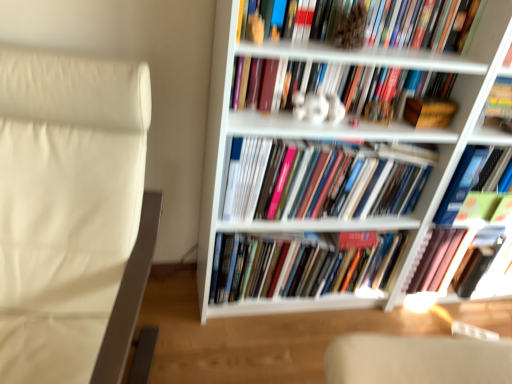
Measure the distance between multicolored paperbacks at center, acting as the 2th book starting from the bottom, and camera.

multicolored paperbacks at center, acting as the 2th book starting from the bottom, and camera are 4.78 feet apart from each other.

This screenshot has width=512, height=384. I want to click on green matte book at upper right, which is the 4th book from top to bottom, so click(464, 181).

What is the approximate width of matte hardcover books at center, which is the fourth book from bottom to top?

It is 4.99 inches.

Where is `multicolored paperbacks at center, acting as the 2th book starting from the bottom`? multicolored paperbacks at center, acting as the 2th book starting from the bottom is located at coordinates (302, 267).

Is hardcover book at upper center, the 6th book in the bottom-to-top sequence, bigger or smaller than hardcover book at center, the 1th book from the bottom?

hardcover book at upper center, the 6th book in the bottom-to-top sequence, is smaller than hardcover book at center, the 1th book from the bottom.

Considering the sizes of objects hardcover book at upper center, the first book when ordered from top to bottom, and hardcover book at center, the sixth book positioned from the top, in the image provided, who is thinner, hardcover book at upper center, the first book when ordered from top to bottom, or hardcover book at center, the sixth book positioned from the top,?

With smaller width is hardcover book at upper center, the first book when ordered from top to bottom.

You are a GUI agent. You are given a task and a screenshot of the screen. Output one action in this format:
    pyautogui.click(x=<x>, y=<y>)
    Task: Click on the 2nd book counting from the left side of the hardcover book at center, the sixth book positioned from the top
    
    Given the screenshot: What is the action you would take?
    pyautogui.click(x=421, y=24)

Looking at this image, from the image's perspective, relative to hardcover book at center, the 1th book from the bottom, is hardcover book at upper center, the 6th book in the bottom-to-top sequence, above or below?

Based on their image positions, hardcover book at upper center, the 6th book in the bottom-to-top sequence, is located above hardcover book at center, the 1th book from the bottom.

Can you tell me how much hardcover book at center, the 1th book from the bottom, and matte hardcover books at center, the 3th book in the top-to-bottom sequence, differ in facing direction?

They differ by 0.354 degrees in their facing directions.

Which is in front, point (477, 149) or point (239, 151)?

Positioned in front is point (239, 151).

Is matte hardcover books at center, which is the fourth book from bottom to top, surrounded by hardcover book at center, the 1th book from the bottom?

Actually, matte hardcover books at center, which is the fourth book from bottom to top, is outside hardcover book at center, the 1th book from the bottom.

Is hardcover book at center, the 1th book from the bottom, turned away from white leather rocking chair at left?

No, hardcover book at center, the 1th book from the bottom,'s orientation is not away from white leather rocking chair at left.

From the image's perspective, is hardcover book at center, the 1th book from the bottom, positioned above or below white leather rocking chair at left?

hardcover book at center, the 1th book from the bottom, is situated higher than white leather rocking chair at left in the image.

Considering the sizes of objects hardcover book at center, the 1th book from the bottom, and white leather rocking chair at left in the image provided, who is smaller, hardcover book at center, the 1th book from the bottom, or white leather rocking chair at left?

Smaller between the two is hardcover book at center, the 1th book from the bottom.

Does hardcover book at center, the 1th book from the bottom, touch white leather rocking chair at left?

No.

Which object is closer to the camera, multicolored paperbacks at center, acting as the fifth book starting from the top, or hardcover book at center, the 1th book from the bottom?

multicolored paperbacks at center, acting as the fifth book starting from the top, is closer to the camera.

From a real-world perspective, who is located higher, multicolored paperbacks at center, acting as the fifth book starting from the top, or hardcover book at center, the 1th book from the bottom?

hardcover book at center, the 1th book from the bottom, from a real-world perspective.

From the picture: Is multicolored paperbacks at center, acting as the fifth book starting from the top, positioned with its back to hardcover book at center, the 1th book from the bottom?

No.

How far apart are multicolored paperbacks at center, acting as the 2th book starting from the bottom, and hardcover book at center, the 1th book from the bottom?

The distance of multicolored paperbacks at center, acting as the 2th book starting from the bottom, from hardcover book at center, the 1th book from the bottom, is 14.97 inches.

Considering the sizes of objects hardcover book at center, the 1th book from the bottom, and white matte bookcase at upper right in the image provided, who is wider, hardcover book at center, the 1th book from the bottom, or white matte bookcase at upper right?

white matte bookcase at upper right is wider.

Does hardcover book at center, the 1th book from the bottom, have a smaller size compared to white matte bookcase at upper right?

Indeed, hardcover book at center, the 1th book from the bottom, has a smaller size compared to white matte bookcase at upper right.

From a real-world perspective, which is physically above, hardcover book at center, the 1th book from the bottom, or white matte bookcase at upper right?

In real-world perspective, white matte bookcase at upper right is above.

Is hardcover book at center, the sixth book positioned from the top, oriented towards white matte bookcase at upper right?

Yes.

Considering the relative positions of hardcover book at upper center, the 6th book in the bottom-to-top sequence, and wooden box at center-right in the image provided, is hardcover book at upper center, the 6th book in the bottom-to-top sequence, to the right of wooden box at center-right from the viewer's perspective?

In fact, hardcover book at upper center, the 6th book in the bottom-to-top sequence, is to the left of wooden box at center-right.

Which is behind, hardcover book at upper center, the 6th book in the bottom-to-top sequence, or wooden box at center-right?

wooden box at center-right.

Is hardcover book at upper center, the 6th book in the bottom-to-top sequence, oriented away from wooden box at center-right?

No.

From the image's perspective, is hardcover book at upper center, the 6th book in the bottom-to-top sequence, above or below wooden box at center-right?

From the image's perspective, hardcover book at upper center, the 6th book in the bottom-to-top sequence, appears above wooden box at center-right.

Can you confirm if hardcover book at upper center, the 6th book in the bottom-to-top sequence, is smaller than matte hardcover books at center, which is the fourth book from bottom to top?

Yes, hardcover book at upper center, the 6th book in the bottom-to-top sequence, is smaller than matte hardcover books at center, which is the fourth book from bottom to top.

The width and height of the screenshot is (512, 384). There is a matte hardcover books at center, the 3th book in the top-to-bottom sequence. Find the location of `the 3rd book above it (from a real-world perspective)`. the 3rd book above it (from a real-world perspective) is located at coordinates (421, 24).

Can you tell me how much hardcover book at upper center, the first book when ordered from top to bottom, and matte hardcover books at center, which is the fourth book from bottom to top, differ in facing direction?

They differ by 0.157 degrees in their facing directions.

In order to click on book that is the 5th one when counting upward from the hardcover book at center, the 1th book from the bottom (from the image's perspective) in this screenshot , I will do `click(421, 24)`.

Where is `the 3rd book behind the matte hardcover books at center, which is the fourth book from bottom to top, starting your count from the anchor`? The width and height of the screenshot is (512, 384). the 3rd book behind the matte hardcover books at center, which is the fourth book from bottom to top, starting your count from the anchor is located at coordinates (449, 223).

Which object lies nearer to the anchor point white glossy statue at upper center, the second book positioned from the top, white leather rocking chair at left or matte hardcover books at center, which is the fourth book from bottom to top?

matte hardcover books at center, which is the fourth book from bottom to top, is positioned closer to the anchor white glossy statue at upper center, the second book positioned from the top.

Looking at the image, which one is located closer to green matte book at upper right, which is the 4th book from top to bottom, hardcover book at upper center, the first book when ordered from top to bottom, or white leather rocking chair at left?

Among the two, hardcover book at upper center, the first book when ordered from top to bottom, is located nearer to green matte book at upper right, which is the 4th book from top to bottom.

Looking at the image, which one is located closer to hardcover book at upper center, the 6th book in the bottom-to-top sequence, white glossy statue at upper center, the second book positioned from the top, or green matte book at upper right, which is the third book in bottom-to-top order?

Based on the image, white glossy statue at upper center, the second book positioned from the top, appears to be nearer to hardcover book at upper center, the 6th book in the bottom-to-top sequence.

Looking at the image, which one is located further to white glossy statue at upper center, marked as the 5th book in a bottom-to-top arrangement, wooden box at center-right or multicolored paperbacks at center, acting as the fifth book starting from the top?

Based on the image, multicolored paperbacks at center, acting as the fifth book starting from the top, appears to be further to white glossy statue at upper center, marked as the 5th book in a bottom-to-top arrangement.

From the image, which object appears to be nearer to white leather rocking chair at left, white matte bookcase at upper right or hardcover book at center, the sixth book positioned from the top?

The object closer to white leather rocking chair at left is white matte bookcase at upper right.

Based on their spatial positions, is multicolored paperbacks at center, acting as the fifth book starting from the top, or white glossy statue at upper center, marked as the 5th book in a bottom-to-top arrangement, further from green matte book at upper right, which is the 4th book from top to bottom?

Among the two, multicolored paperbacks at center, acting as the fifth book starting from the top, is located further to green matte book at upper right, which is the 4th book from top to bottom.

When comparing their distances from white glossy statue at upper center, the second book positioned from the top, does green matte book at upper right, which is the 4th book from top to bottom, or hardcover book at center, the 1th book from the bottom, seem closer?

green matte book at upper right, which is the 4th book from top to bottom, is closer to white glossy statue at upper center, the second book positioned from the top.

Looking at the image, which one is located closer to white glossy statue at upper center, the second book positioned from the top, multicolored paperbacks at center, acting as the 2th book starting from the bottom, or hardcover book at upper center, the first book when ordered from top to bottom?

The object closer to white glossy statue at upper center, the second book positioned from the top, is hardcover book at upper center, the first book when ordered from top to bottom.

Identify the location of bookcase between hardcover book at upper center, the first book when ordered from top to bottom, and hardcover book at center, the sixth book positioned from the top, vertically. Image resolution: width=512 pixels, height=384 pixels. (337, 150).

The height and width of the screenshot is (384, 512). Identify the location of bookcase located between multicolored paperbacks at center, acting as the 2th book starting from the bottom, and green matte book at upper right, which is the third book in bottom-to-top order, in the left-right direction. (337, 150).

Identify the location of bookcase between white glossy statue at upper center, marked as the 5th book in a bottom-to-top arrangement, and green matte book at upper right, which is the third book in bottom-to-top order, from left to right. This screenshot has width=512, height=384. [x=337, y=150].

At what (x,y) coordinates should I click in order to perform the action: click on book situated between white glossy statue at upper center, the second book positioned from the top, and wooden box at center-right from left to right. Please return your answer as a coordinate pair (x, y). Image resolution: width=512 pixels, height=384 pixels. Looking at the image, I should click on (421, 24).